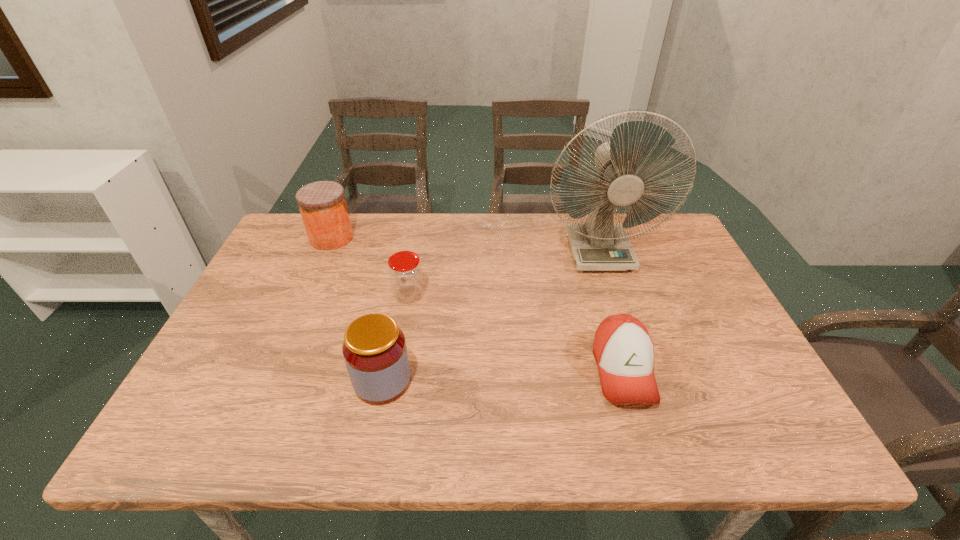
At what (x,y) coordinates should I click in order to perform the action: click on vacant region at the left edge of the desktop. Please return your answer as a coordinate pair (x, y). Looking at the image, I should click on (258, 386).

The width and height of the screenshot is (960, 540). I want to click on free space at the right edge of the desktop, so click(645, 266).

Find the location of a particular element. The height and width of the screenshot is (540, 960). free space at the far right corner of the desktop is located at coordinates (685, 252).

Where is `free point between the tallest object and the nearest jar`? free point between the tallest object and the nearest jar is located at coordinates (492, 316).

Where is `vacant space that is in between the third nearest object and the tallest object`? The image size is (960, 540). vacant space that is in between the third nearest object and the tallest object is located at coordinates (x=504, y=273).

Where is `empty space between the baseball cap and the shortest jar`? empty space between the baseball cap and the shortest jar is located at coordinates (516, 333).

Locate an element on the screen. unoccupied area between the third nearest object and the baseball cap is located at coordinates (516, 333).

This screenshot has height=540, width=960. I want to click on vacant area between the leftmost jar and the nearest jar, so click(x=357, y=309).

At what (x,y) coordinates should I click in order to perform the action: click on empty space that is in between the baseball cap and the tallest object. Please return your answer as a coordinate pair (x, y). Looking at the image, I should click on (612, 310).

What are the coordinates of `free space between the baseball cap and the nearest jar` in the screenshot? It's located at (503, 375).